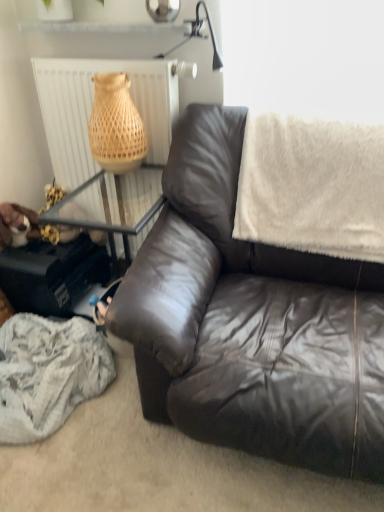
Question: Considering the positions of matte brown leather couch at center and white textured radiator at upper left in the image, is matte brown leather couch at center bigger or smaller than white textured radiator at upper left?

Choices:
 (A) small
 (B) big

Answer: (B)

Question: Relative to white textured radiator at upper left, is matte brown leather couch at center in front or behind?

Choices:
 (A) behind
 (B) front

Answer: (B)

Question: Which object is positioned farthest from the white textured radiator at upper left?

Choices:
 (A) white fluffy blanket at upper right
 (B) matte brown leather couch at center

Answer: (B)

Question: Which object is the closest to the white textured radiator at upper left?

Choices:
 (A) white fluffy blanket at upper right
 (B) matte brown leather couch at center

Answer: (A)